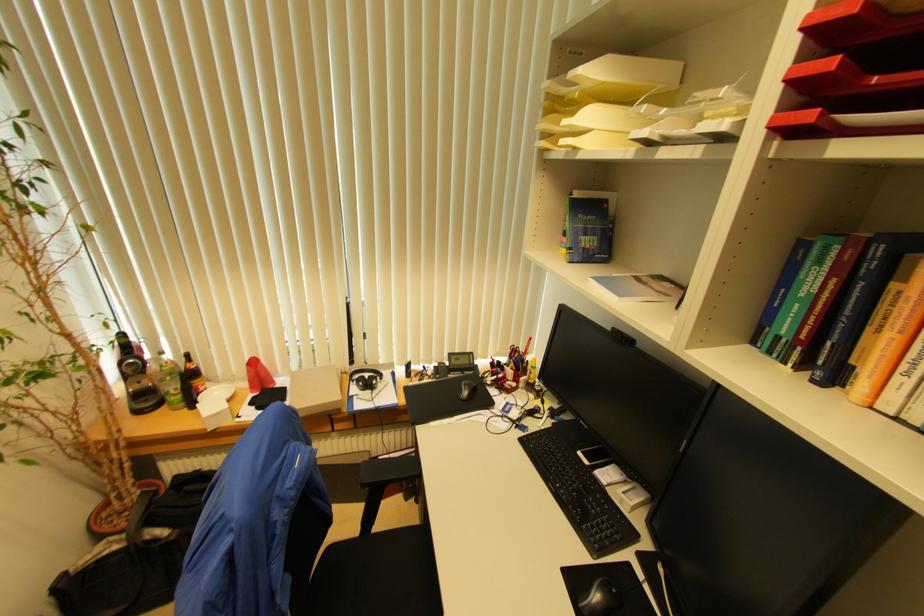
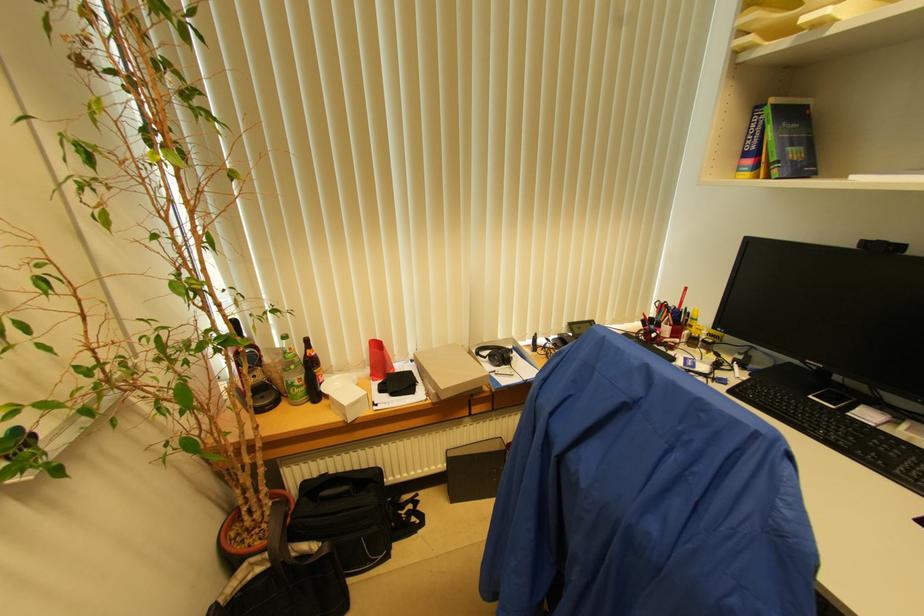
Where in the second image is the point corresponding to (x=371, y=384) from the first image?

(506, 358)